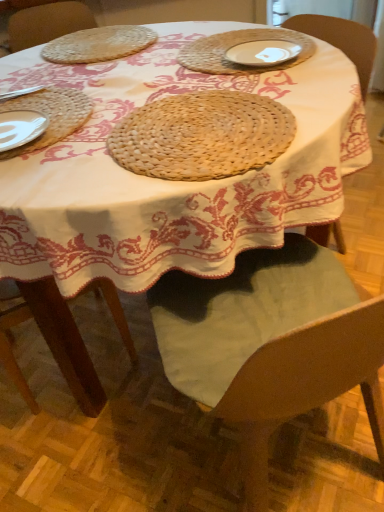
At what (x,y) coordinates should I click in order to perform the action: click on vacant area situated below wooden chair at center (from a real-world perspective). Please return your answer as a coordinate pair (x, y). The height and width of the screenshot is (512, 384). Looking at the image, I should click on (305, 459).